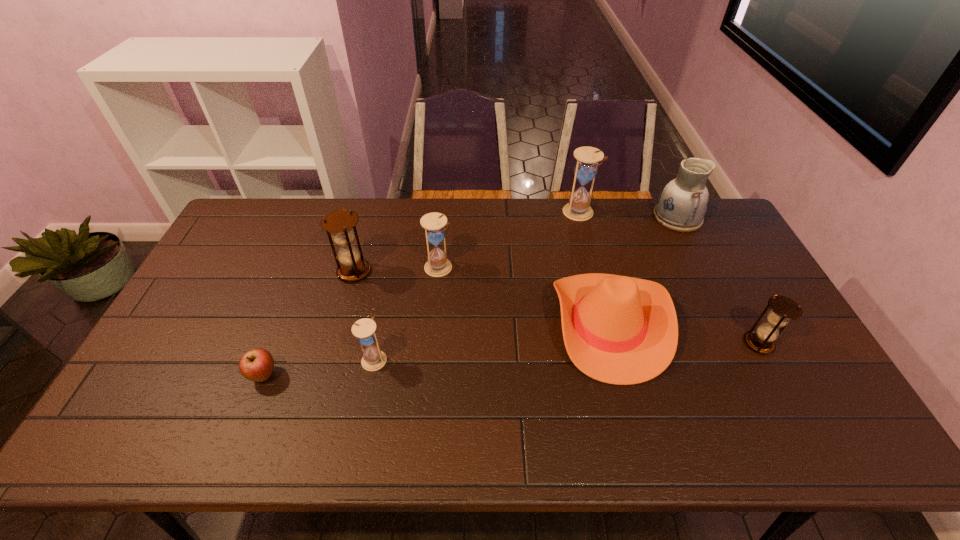
Locate an element on the screen. The image size is (960, 540). blank region between the smallest white hourglass and the blue pottery is located at coordinates click(x=526, y=288).

At what (x,y) coordinates should I click in order to perform the action: click on object that is the sixth nearest to the seventh object from right to left. Please return your answer as a coordinate pair (x, y). Looking at the image, I should click on (681, 206).

Select which object is the third closest to the leftmost hourglass. Please provide its 2D coordinates. Your answer should be formatted as a tuple, i.e. [(x, y)], where the tuple contains the x and y coordinates of a point satisfying the conditions above.

[(256, 365)]

Identify which hourglass is the third closest to the fourth hourglass from left to right. Please provide its 2D coordinates. Your answer should be formatted as a tuple, i.e. [(x, y)], where the tuple contains the x and y coordinates of a point satisfying the conditions above.

[(352, 267)]

Where is `the second closest hourglass to the second farthest white hourglass`? The height and width of the screenshot is (540, 960). the second closest hourglass to the second farthest white hourglass is located at coordinates (373, 359).

Find the location of a particular element. white hourglass that is the second closest to the pottery is located at coordinates (437, 265).

Locate an element on the screen. white hourglass that is the nearest to the tallest hourglass is located at coordinates (437, 265).

I want to click on vacant space that satisfies the following two spatial constraints: 1. on the front side of the cowboy hat; 2. on the left side of the third hourglass from left to right, so click(434, 324).

The width and height of the screenshot is (960, 540). I want to click on vacant space that satisfies the following two spatial constraints: 1. on the back side of the blue pottery; 2. on the left side of the fourth hourglass from right to left, so click(402, 217).

Where is `vacant space that satisfies the following two spatial constraints: 1. on the back side of the cowboy hat; 2. on the left side of the apple`? vacant space that satisfies the following two spatial constraints: 1. on the back side of the cowboy hat; 2. on the left side of the apple is located at coordinates (283, 324).